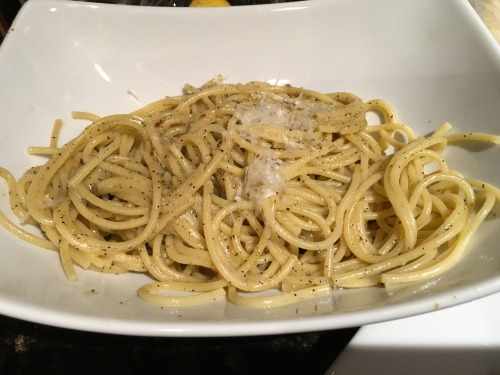
Where is `light reflection spots`? This screenshot has height=375, width=500. light reflection spots is located at coordinates (100, 75), (55, 10), (94, 7), (287, 10).